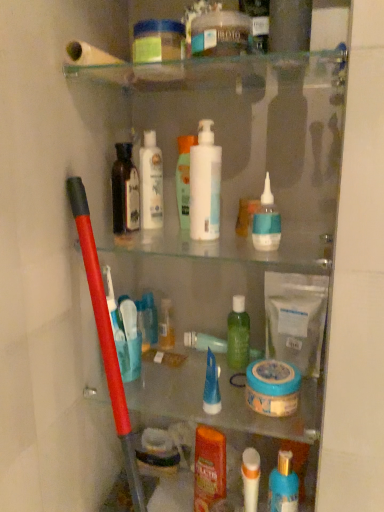
Question: In the image, is white glossy mouthwash at center, the first mouthwash viewed from the left, positioned in front of or behind white matte toothbrush at lower center, arranged as the 3th toiletry when viewed from the right?

Choices:
 (A) front
 (B) behind

Answer: (B)

Question: From their relative heights in the image, would you say white glossy mouthwash at center, which is counted as the 2th mouthwash, starting from the right, is taller or shorter than white matte toothbrush at lower center, arranged as the eighth toiletry when viewed from the left?

Choices:
 (A) tall
 (B) short

Answer: (A)

Question: Which object is positioned farthest from the blue gel tube at center, the sixth toiletry from the right?

Choices:
 (A) white glossy mouthwash at center, which appears as the first mouthwash when viewed from the top
 (B) blue glossy nasal spray at upper center, which is the second toiletry in right-to-left order
 (C) translucent plastic pump bottle at lower center, the first toiletry positioned from the right
 (D) white matte toothbrush at lower center, arranged as the eighth toiletry when viewed from the left
 (E) white glossy lotion at center, arranged as the second toiletry when viewed from the left

Answer: (E)

Question: Estimate the real-world distances between objects in this image. Which object is farther from the white matte toothbrush at lower center, arranged as the eighth toiletry when viewed from the left?

Choices:
 (A) dark brown glass bottle at upper left, the 1th toiletry in the left-to-right sequence
 (B) translucent plastic pump bottle at lower center, the first toiletry positioned from the right
 (C) blue gel tube at center, the sixth toiletry from the right
 (D) translucent plastic bottle at center, which ranks as the eighth toiletry in right-to-left order
 (E) blue matte jar at center bottom, which is the first mouthwash from right to left

Answer: (A)